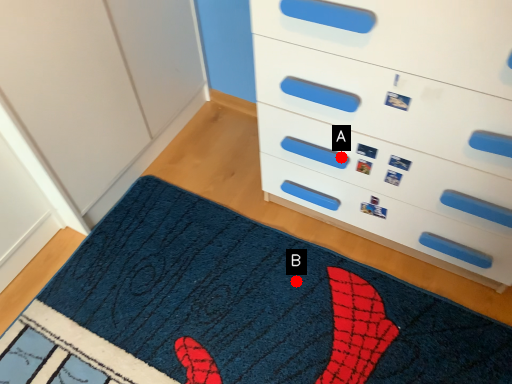
Question: Two points are circled on the image, labeled by A and B beside each circle. Which of the following is the closest to the observer?

Choices:
 (A) A is closer
 (B) B is closer

Answer: (A)